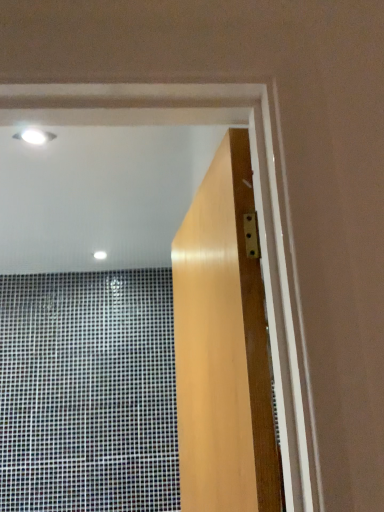
Question: Should I look upward or downward to see light brown wood door at center?

Choices:
 (A) up
 (B) down

Answer: (B)